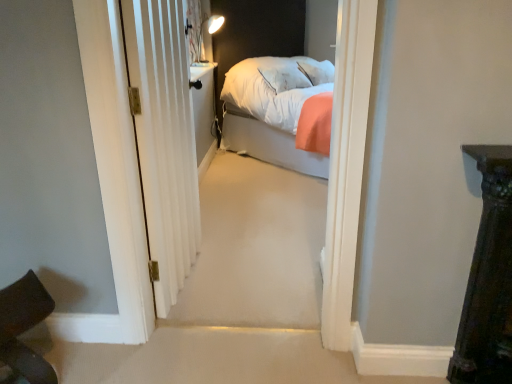
Locate an element on the screen. The height and width of the screenshot is (384, 512). free region under white textured door at center (from a real-world perspective) is located at coordinates (186, 275).